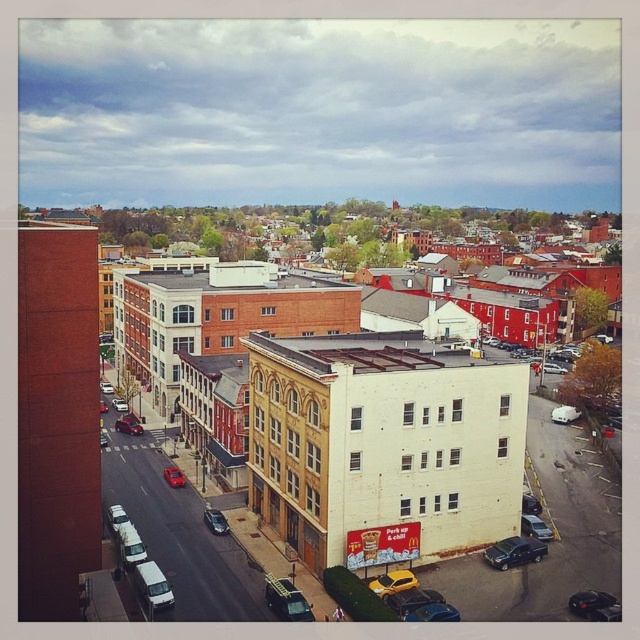
Can you confirm if metallic blue sedan at lower center is thinner than satin black sedan at lower right?

In fact, metallic blue sedan at lower center might be wider than satin black sedan at lower right.

Who is lower down, metallic blue sedan at lower center or satin black sedan at lower right?

metallic blue sedan at lower center is lower down.

Find the location of a particular element. metallic blue sedan at lower center is located at coordinates coord(433,612).

Which is in front, point (204, 516) or point (104, 392)?

Point (204, 516)

Can you confirm if shiny silver sedan at center is positioned below red matte car at center-left?

Yes, shiny silver sedan at center is below red matte car at center-left.

The width and height of the screenshot is (640, 640). Identify the location of shiny silver sedan at center. (216, 522).

Between white brick building at center and white matte car at center-right, which one is positioned lower?

white matte car at center-right is lower down.

Between white brick building at center and white matte car at center-right, which one has more height?

With more height is white brick building at center.

The width and height of the screenshot is (640, 640). What do you see at coordinates (132, 218) in the screenshot?
I see `white brick building at center` at bounding box center [132, 218].

I want to click on white brick building at center, so click(x=132, y=218).